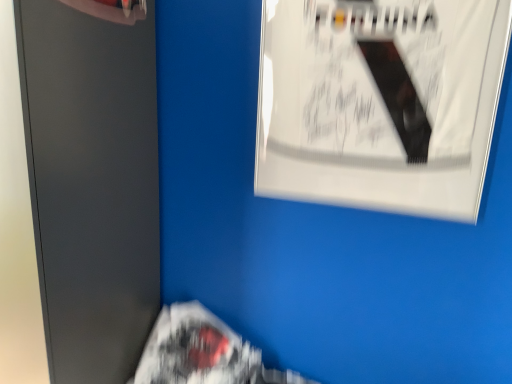
Question: Is matte gray file cabinet at left to the right of white glossy poster at upper right from the viewer's perspective?

Choices:
 (A) no
 (B) yes

Answer: (A)

Question: Is white glossy poster at upper right inside matte gray file cabinet at left?

Choices:
 (A) no
 (B) yes

Answer: (A)

Question: From a real-world perspective, is matte gray file cabinet at left beneath white glossy poster at upper right?

Choices:
 (A) no
 (B) yes

Answer: (B)

Question: Can you confirm if matte gray file cabinet at left is smaller than white glossy poster at upper right?

Choices:
 (A) no
 (B) yes

Answer: (A)

Question: Is matte gray file cabinet at left directly adjacent to white glossy poster at upper right?

Choices:
 (A) yes
 (B) no

Answer: (B)

Question: Does point (129, 382) appear closer or farther from the camera than point (74, 241)?

Choices:
 (A) closer
 (B) farther

Answer: (B)

Question: Is white paper flyer at lower center spatially inside matte gray file cabinet at left, or outside of it?

Choices:
 (A) outside
 (B) inside

Answer: (A)

Question: In the image, is white paper flyer at lower center positioned in front of or behind matte gray file cabinet at left?

Choices:
 (A) front
 (B) behind

Answer: (B)

Question: In terms of height, does white paper flyer at lower center look taller or shorter compared to matte gray file cabinet at left?

Choices:
 (A) short
 (B) tall

Answer: (A)

Question: Based on their sizes in the image, would you say white paper flyer at lower center is bigger or smaller than white glossy poster at upper right?

Choices:
 (A) small
 (B) big

Answer: (B)

Question: From a real-world perspective, is white paper flyer at lower center physically located above or below white glossy poster at upper right?

Choices:
 (A) above
 (B) below

Answer: (B)

Question: Is white paper flyer at lower center situated inside white glossy poster at upper right or outside?

Choices:
 (A) outside
 (B) inside

Answer: (A)

Question: From the image's perspective, relative to white glossy poster at upper right, is white paper flyer at lower center above or below?

Choices:
 (A) above
 (B) below

Answer: (B)

Question: Considering the positions of matte gray file cabinet at left and white glossy poster at upper right in the image, is matte gray file cabinet at left wider or thinner than white glossy poster at upper right?

Choices:
 (A) wide
 (B) thin

Answer: (A)

Question: Looking at the image, does matte gray file cabinet at left seem bigger or smaller compared to white glossy poster at upper right?

Choices:
 (A) big
 (B) small

Answer: (A)